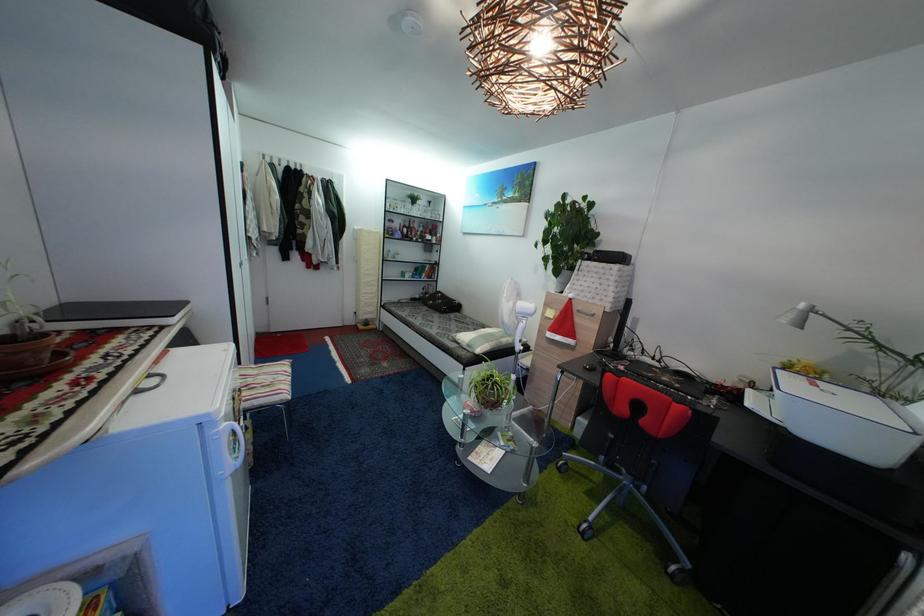
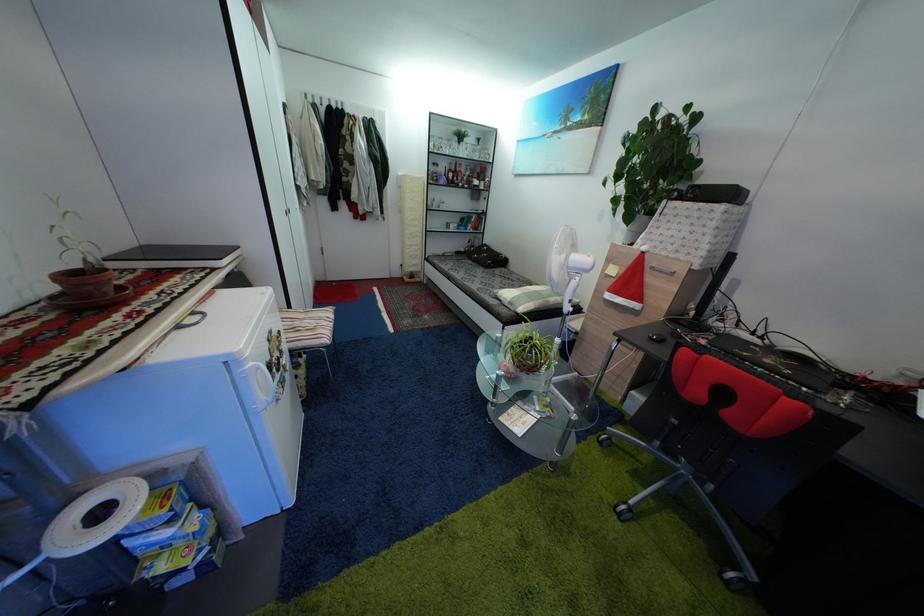
Where in the second image is the point corresponding to (x=489, y=405) from the first image?

(525, 368)